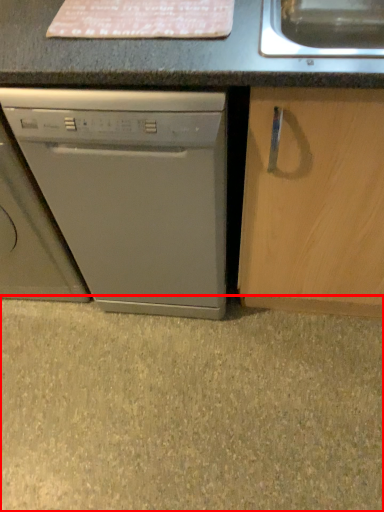
Question: From the image, what is the correct spatial relationship of concrete (annotated by the red box) in relation to washing machine?

Choices:
 (A) left
 (B) right

Answer: (B)